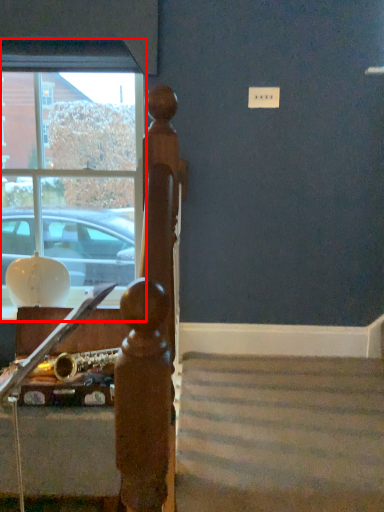
Question: From the image's perspective, where is window (annotated by the red box) located in relation to furniture in the image?

Choices:
 (A) below
 (B) above

Answer: (B)